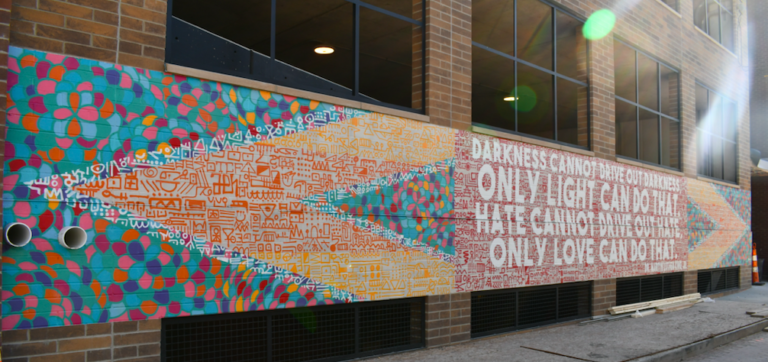
Where is `left pipe`? left pipe is located at coordinates (15, 240).